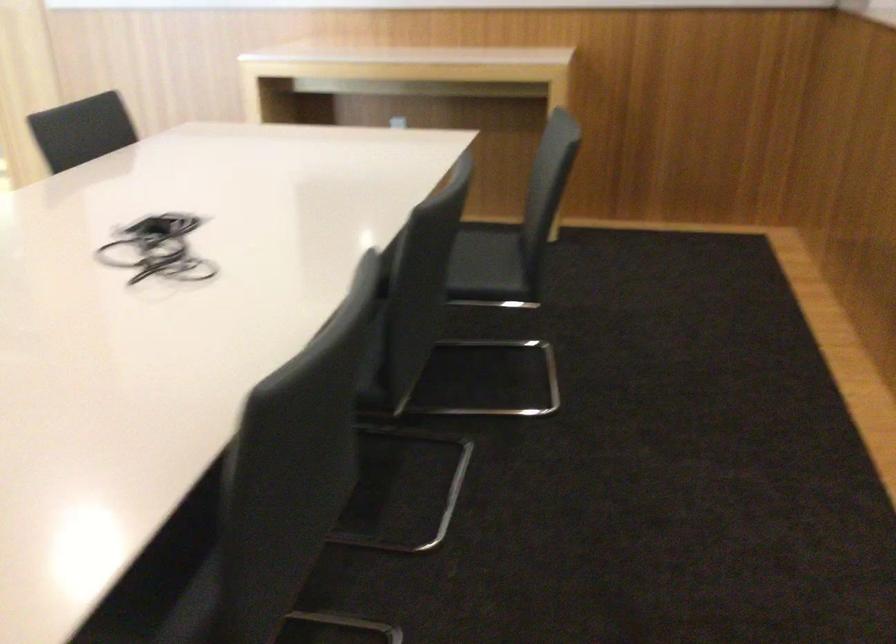
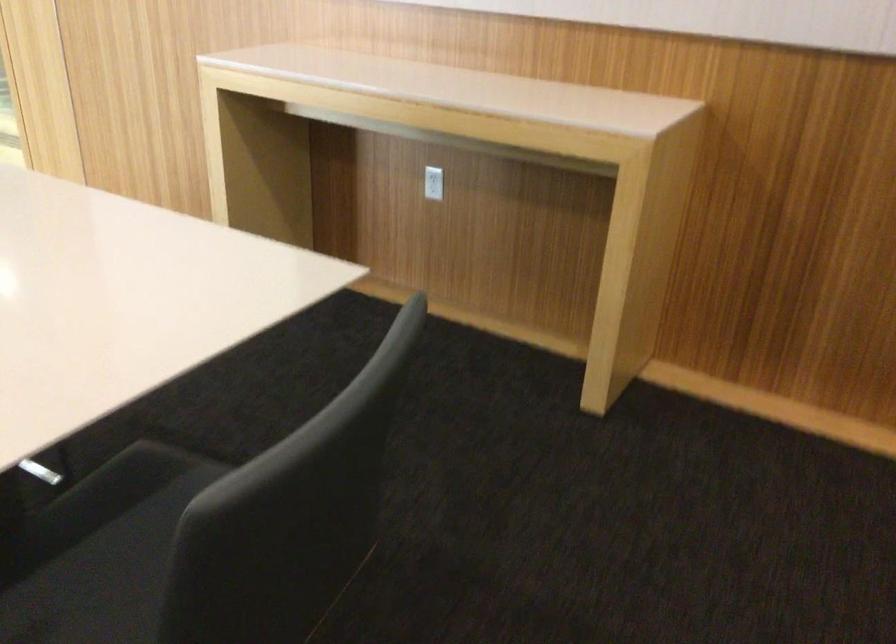
The point at (394, 118) is marked in the first image. Where is the corresponding point in the second image?

(433, 183)